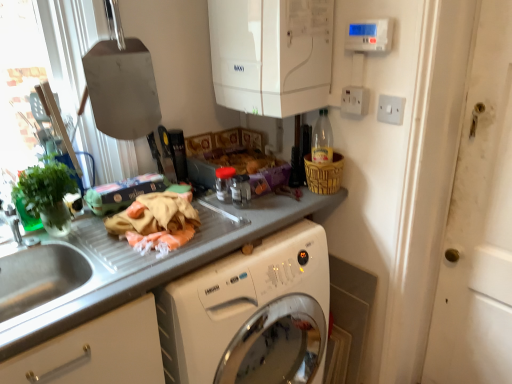
Locate an element on the screen. The width and height of the screenshot is (512, 384). vacant area that is in front of transparent plastic spice jar at center, which is counted as the 2th appliance, starting from the left is located at coordinates [232, 225].